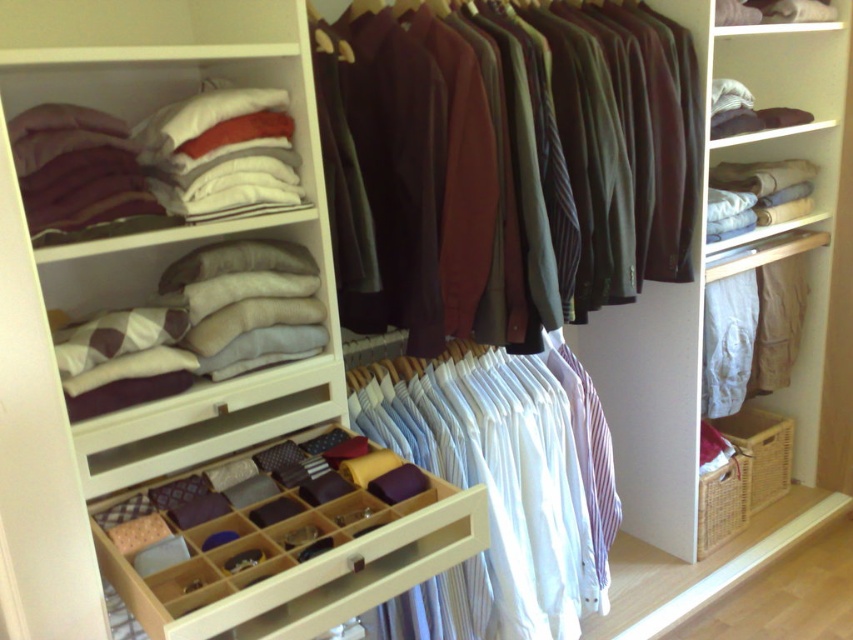
You are standing in the walk in closet and want to reach both point (683, 65) and point (488, 404). Which point will you reach first?

Point (683, 65) is further to the viewer than point (488, 404), so you will reach point (683, 65) first.

You are organizing a closet and see the dark brown wool sweaters at center and the white cotton shirts at center. Which item is located to the right of the other?

The dark brown wool sweaters at center is positioned on the right side of white cotton shirts at center.

Based on the photo, you are trying to fit a new accessory organizer into the space between the dark brown wool sweaters at center and the wooden tie organizer at center. The accessory organizer is 1.2 meters wide. Can it fit if the combined width of the two items is 1.5 meters?

The dark brown wool sweaters at center are wider than the wooden tie organizer at center. The combined width of both items is 1.5 meters, so the accessory organizer that is 1.2 meters wide can fit since it is narrower than the combined space available.